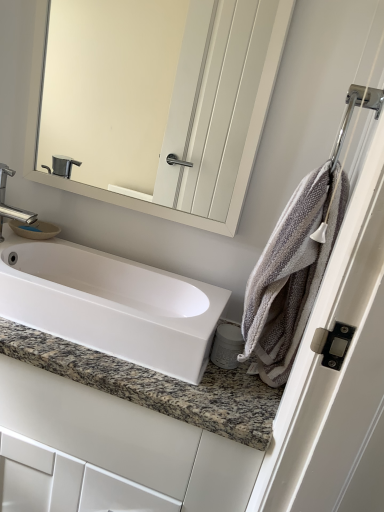
Question: Can you confirm if gray textured towel at right is wider than chrome metallic towel bar at upper right?

Choices:
 (A) no
 (B) yes

Answer: (B)

Question: Could chrome metallic towel bar at upper right be considered to be inside gray textured towel at right?

Choices:
 (A) no
 (B) yes

Answer: (A)

Question: Is gray textured towel at right smaller than chrome metallic towel bar at upper right?

Choices:
 (A) no
 (B) yes

Answer: (A)

Question: Is there a large distance between gray textured towel at right and chrome metallic towel bar at upper right?

Choices:
 (A) yes
 (B) no

Answer: (B)

Question: Is gray textured towel at right shorter than chrome metallic towel bar at upper right?

Choices:
 (A) yes
 (B) no

Answer: (B)

Question: Is white glossy cabinet at center to the left or to the right of white glossy sink at center in the image?

Choices:
 (A) left
 (B) right

Answer: (A)

Question: Looking at their shapes, would you say white glossy cabinet at center is wider or thinner than white glossy sink at center?

Choices:
 (A) thin
 (B) wide

Answer: (B)

Question: From the image's perspective, relative to white glossy sink at center, is white glossy cabinet at center above or below?

Choices:
 (A) below
 (B) above

Answer: (A)

Question: Is white glossy cabinet at center taller or shorter than white glossy sink at center?

Choices:
 (A) tall
 (B) short

Answer: (A)

Question: Which is correct: white glossy cabinet at center is inside gray textured towel at right, or outside of it?

Choices:
 (A) inside
 (B) outside

Answer: (B)

Question: Is white glossy cabinet at center in front of or behind gray textured towel at right in the image?

Choices:
 (A) front
 (B) behind

Answer: (B)

Question: Does point (187, 489) appear closer or farther from the camera than point (268, 284)?

Choices:
 (A) closer
 (B) farther

Answer: (B)

Question: Based on their positions, is white glossy cabinet at center located to the left or right of gray textured towel at right?

Choices:
 (A) left
 (B) right

Answer: (A)

Question: Is gray textured towel at right in front of or behind white glossy cabinet at center in the image?

Choices:
 (A) front
 (B) behind

Answer: (A)

Question: Is gray textured towel at right wider or thinner than white glossy cabinet at center?

Choices:
 (A) wide
 (B) thin

Answer: (B)